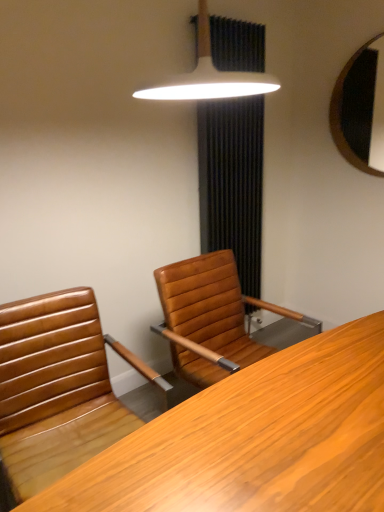
Question: Does brown leather chair at center lie in front of wooden mirror at upper right?

Choices:
 (A) yes
 (B) no

Answer: (A)

Question: Considering the relative positions of brown leather chair at center and wooden mirror at upper right in the image provided, is brown leather chair at center to the left of wooden mirror at upper right from the viewer's perspective?

Choices:
 (A) yes
 (B) no

Answer: (A)

Question: From the image's perspective, would you say brown leather chair at center is positioned over wooden mirror at upper right?

Choices:
 (A) yes
 (B) no

Answer: (B)

Question: Does brown leather chair at center have a greater height compared to wooden mirror at upper right?

Choices:
 (A) yes
 (B) no

Answer: (A)

Question: Is brown leather chair at center aimed at wooden mirror at upper right?

Choices:
 (A) no
 (B) yes

Answer: (A)

Question: Is black fabric curtain at upper center inside or outside of white glossy lampshade at upper center?

Choices:
 (A) inside
 (B) outside

Answer: (B)

Question: Visually, is black fabric curtain at upper center positioned to the left or to the right of white glossy lampshade at upper center?

Choices:
 (A) left
 (B) right

Answer: (B)

Question: From a real-world perspective, is black fabric curtain at upper center physically located above or below white glossy lampshade at upper center?

Choices:
 (A) below
 (B) above

Answer: (A)

Question: Relative to white glossy lampshade at upper center, is black fabric curtain at upper center in front or behind?

Choices:
 (A) behind
 (B) front

Answer: (A)

Question: From the image's perspective, is wooden mirror at upper right located above or below black fabric curtain at upper center?

Choices:
 (A) above
 (B) below

Answer: (A)

Question: Would you say wooden mirror at upper right is inside or outside black fabric curtain at upper center?

Choices:
 (A) outside
 (B) inside

Answer: (A)

Question: Is point (349, 76) closer or farther from the camera than point (248, 273)?

Choices:
 (A) closer
 (B) farther

Answer: (B)

Question: In the image, is wooden mirror at upper right positioned in front of or behind black fabric curtain at upper center?

Choices:
 (A) front
 (B) behind

Answer: (B)

Question: From the image's perspective, is wooden mirror at upper right located above or below white glossy lampshade at upper center?

Choices:
 (A) above
 (B) below

Answer: (A)

Question: Considering the positions of point (380, 50) and point (173, 93), is point (380, 50) closer or farther from the camera than point (173, 93)?

Choices:
 (A) farther
 (B) closer

Answer: (A)